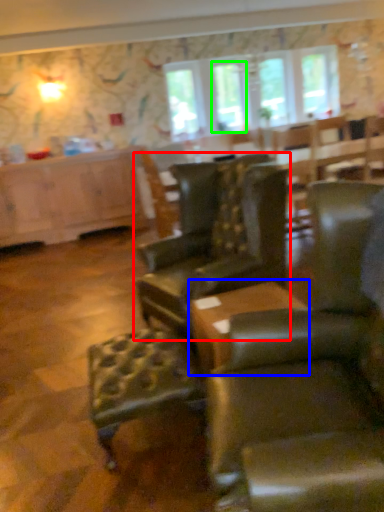
Question: Based on their relative distances, which object is farther from chair (highlighted by a red box)? Choose from table (highlighted by a blue box) and window (highlighted by a green box).

Choices:
 (A) table
 (B) window

Answer: (B)